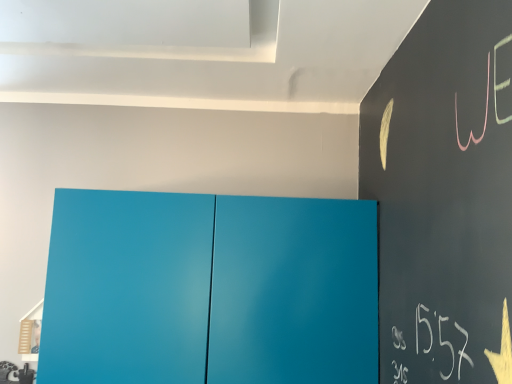
Where is `matte blue door at center`? The height and width of the screenshot is (384, 512). matte blue door at center is located at coordinates (209, 290).

Describe the element at coordinates (209, 290) in the screenshot. I see `matte blue door at center` at that location.

In order to face matte blue door at center, should I rotate leftwards or rightwards?

It's best to rotate left around 5.450 degrees.

At what (x,y) coordinates should I click in order to perform the action: click on matte blue door at center. Please return your answer as a coordinate pair (x, y). The image size is (512, 384). Looking at the image, I should click on (209, 290).